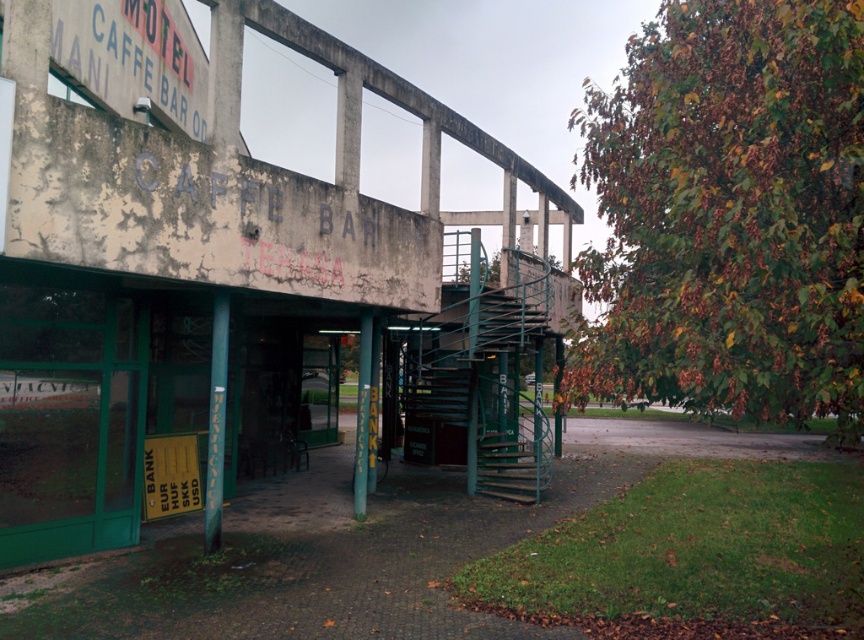
Question: Which object is farther from the camera taking this photo?

Choices:
 (A) green metal staircase at lower center
 (B) weathered concrete sign at upper left

Answer: (A)

Question: Where is green metal staircase at lower center located in relation to yellow plastic sign at lower left in the image?

Choices:
 (A) right
 (B) left

Answer: (A)

Question: Does green metal staircase at lower center have a greater width compared to yellow plastic sign at lower left?

Choices:
 (A) yes
 (B) no

Answer: (A)

Question: Which object is farther from the camera taking this photo?

Choices:
 (A) weathered concrete sign at upper left
 (B) green metal staircase at lower center

Answer: (B)

Question: Estimate the real-world distances between objects in this image. Which object is farther from the green metal staircase at lower center?

Choices:
 (A) weathered concrete sign at upper left
 (B) yellow plastic sign at lower left

Answer: (A)

Question: Does green metal staircase at lower center appear on the right side of yellow plastic sign at lower left?

Choices:
 (A) yes
 (B) no

Answer: (A)